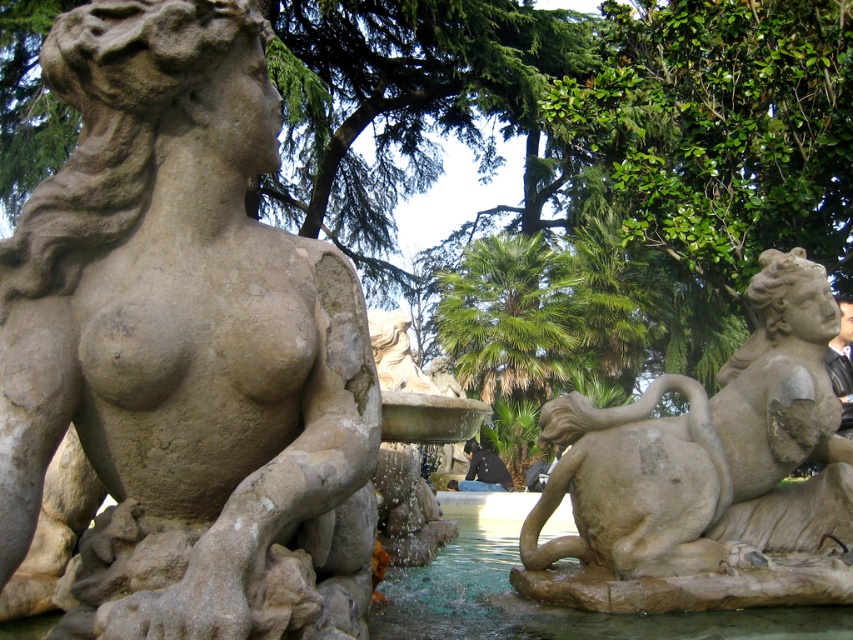
Question: Considering the real-world distances, which object is farthest from the matte stone lioness at right?

Choices:
 (A) clear water at fountain center
 (B) matte stone statue at left

Answer: (B)

Question: Is matte stone statue at left wider than matte stone lioness at right?

Choices:
 (A) yes
 (B) no

Answer: (B)

Question: Is matte stone statue at left closer to the viewer compared to matte stone lioness at right?

Choices:
 (A) no
 (B) yes

Answer: (B)

Question: Can you confirm if matte stone statue at left is positioned to the right of matte stone lioness at right?

Choices:
 (A) yes
 (B) no

Answer: (B)

Question: Which object appears farthest from the camera in this image?

Choices:
 (A) matte stone lioness at right
 (B) matte stone statue at left
 (C) clear water at fountain center

Answer: (A)

Question: Which of the following is the farthest from the observer?

Choices:
 (A) clear water at fountain center
 (B) matte stone statue at left
 (C) matte stone lioness at right

Answer: (C)